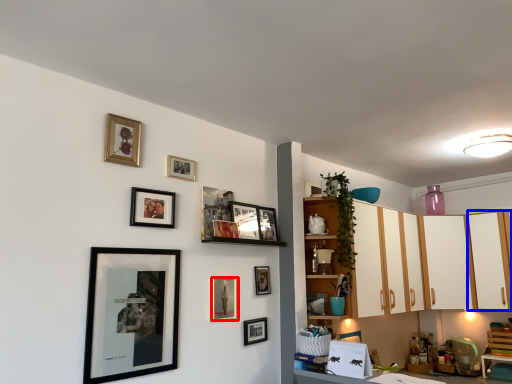
Question: Which object is closer to the camera taking this photo, picture frame (highlighted by a red box) or cabinetry (highlighted by a blue box)?

Choices:
 (A) picture frame
 (B) cabinetry

Answer: (A)